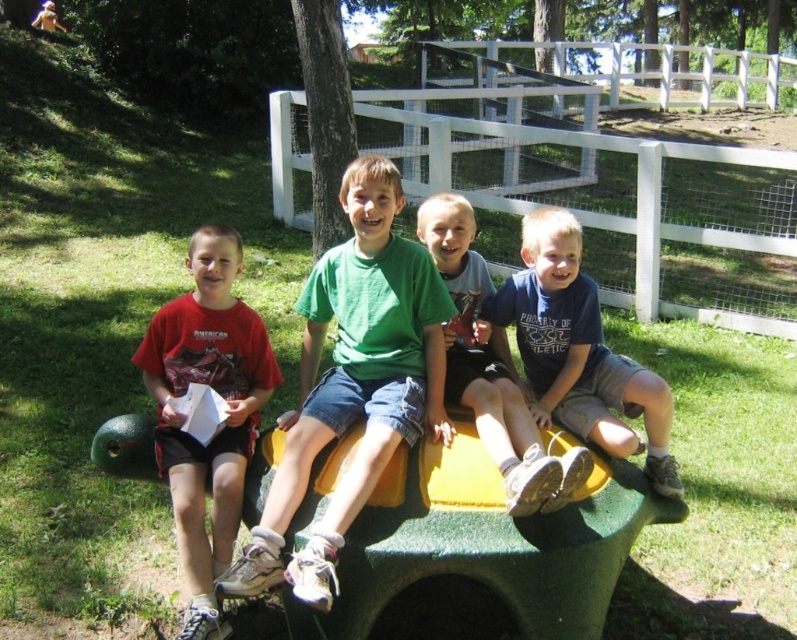
Can you confirm if green cotton shirt at center is positioned to the left of matte red t-shirt at left?

In fact, green cotton shirt at center is to the right of matte red t-shirt at left.

The height and width of the screenshot is (640, 797). What do you see at coordinates (352, 381) in the screenshot? I see `green cotton shirt at center` at bounding box center [352, 381].

The height and width of the screenshot is (640, 797). Identify the location of green cotton shirt at center. (352, 381).

Is the position of green cotton shirt at center more distant than that of blue cotton shirt at center?

No, green cotton shirt at center is in front of blue cotton shirt at center.

Is green cotton shirt at center above blue cotton shirt at center?

No.

Is point (289, 563) more distant than point (511, 301)?

No, (289, 563) is in front of (511, 301).

Locate an element on the screen. green cotton shirt at center is located at coordinates (352, 381).

Does matte red t-shirt at left have a greater width compared to matte green t-shirt at center?

Yes, matte red t-shirt at left is wider than matte green t-shirt at center.

Measure the distance between matte red t-shirt at left and matte green t-shirt at center.

matte red t-shirt at left and matte green t-shirt at center are 88.47 centimeters apart.

Does point (175, 477) come behind point (481, 285)?

No, (175, 477) is in front of (481, 285).

Locate an element on the screen. matte red t-shirt at left is located at coordinates [x=222, y=420].